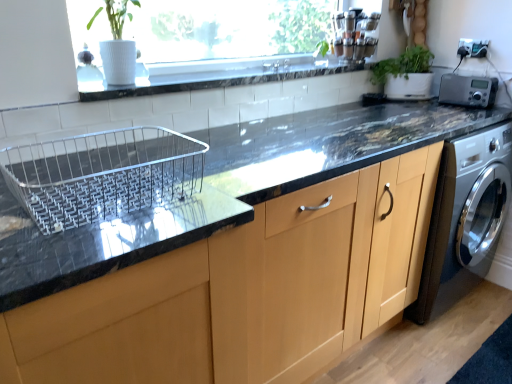
Where is `white tile at upper center`? The image size is (512, 384). white tile at upper center is located at coordinates (217, 80).

What is the approximate width of matte wood cabinet at center?

matte wood cabinet at center is 65.91 centimeters wide.

Where is `silver metallic radio at upper right`? This screenshot has height=384, width=512. silver metallic radio at upper right is located at coordinates (468, 90).

Does silver metallic radio at upper right lie behind green matte plant at upper right?

No, silver metallic radio at upper right is in front of green matte plant at upper right.

Is silver metallic radio at upper right turned away from green matte plant at upper right?

No, silver metallic radio at upper right's orientation is not away from green matte plant at upper right.

Is silver metallic radio at upper right far from green matte plant at upper right?

silver metallic radio at upper right is actually quite close to green matte plant at upper right.

Locate an element on the screen. This screenshot has height=384, width=512. appliance below the green matte plant at upper right (from a real-world perspective) is located at coordinates (468, 90).

Can you tell me how much white tile at upper center and matte wood cabinet at center differ in facing direction?

The angular difference between white tile at upper center and matte wood cabinet at center is 0.000114 degrees.

Considering the sizes of white tile at upper center and matte wood cabinet at center in the image, is white tile at upper center taller or shorter than matte wood cabinet at center?

Considering their sizes, white tile at upper center has less height than matte wood cabinet at center.

Looking at their sizes, would you say white tile at upper center is wider or thinner than matte wood cabinet at center?

In the image, white tile at upper center appears to be more narrow than matte wood cabinet at center.

Does green matte plant at upper right touch white tile at upper center?

green matte plant at upper right is not next to white tile at upper center, and they're not touching.

Locate an element on the screen. window sill in front of the green matte plant at upper right is located at coordinates (217, 80).

What's the angular difference between green matte plant at upper right and white tile at upper center's facing directions?

The angular difference between green matte plant at upper right and white tile at upper center is 40.6 degrees.

Considering the sizes of green matte plant at upper right and white tile at upper center in the image, is green matte plant at upper right bigger or smaller than white tile at upper center?

Considering their sizes, green matte plant at upper right takes up more space than white tile at upper center.

Is matte wood cabinet at center inside the boundaries of silver metallic radio at upper right, or outside?

matte wood cabinet at center is not enclosed by silver metallic radio at upper right.

Consider the image. How many degrees apart are the facing directions of matte wood cabinet at center and silver metallic radio at upper right?

90 degrees.

In terms of width, does matte wood cabinet at center look wider or thinner when compared to silver metallic radio at upper right?

In the image, matte wood cabinet at center appears to be wider than silver metallic radio at upper right.

Is matte wood cabinet at center oriented away from silver metallic radio at upper right?

No, matte wood cabinet at center is not facing the opposite direction of silver metallic radio at upper right.

From a real-world perspective, which object rests below the other?

silver metallic radio at upper right is physically lower.

Do you think white tile at upper center is within silver metallic radio at upper right, or outside of it?

white tile at upper center exists outside the volume of silver metallic radio at upper right.

Is silver metallic radio at upper right at the back of white tile at upper center?

No, white tile at upper center is not facing away from silver metallic radio at upper right.

Which is in front, white tile at upper center or silver metallic radio at upper right?

white tile at upper center.

This screenshot has height=384, width=512. Identify the location of appliance that is under the white tile at upper center (from a real-world perspective). (468, 90).

Which object is wider, silver metallic radio at upper right or white tile at upper center?

Wider between the two is white tile at upper center.

From a real-world perspective, which is physically below, silver metallic radio at upper right or white tile at upper center?

From a 3D spatial view, silver metallic radio at upper right is below.

From a real-world perspective, which is physically below, green matte plant at upper right or silver metallic radio at upper right?

silver metallic radio at upper right.

Visually, is green matte plant at upper right positioned to the left or to the right of silver metallic radio at upper right?

Clearly, green matte plant at upper right is on the left of silver metallic radio at upper right in the image.

Measure the distance from green matte plant at upper right to silver metallic radio at upper right.

A distance of 8.88 inches exists between green matte plant at upper right and silver metallic radio at upper right.

What's the angular difference between green matte plant at upper right and silver metallic radio at upper right's facing directions?

The facing directions of green matte plant at upper right and silver metallic radio at upper right are 49.4 degrees apart.

Where is `appliance in front of the green matte plant at upper right`? This screenshot has height=384, width=512. appliance in front of the green matte plant at upper right is located at coordinates (468, 90).

This screenshot has width=512, height=384. Identify the location of cabinetry that is below the white tile at upper center (from the image's perspective). (319, 270).

Looking at the image, which one is located closer to matte wood cabinet at center, green matte plant at upper right or white tile at upper center?

white tile at upper center is positioned closer to the anchor matte wood cabinet at center.

Considering their positions, is matte wood cabinet at center positioned further to silver metallic radio at upper right than green matte plant at upper right?

Among the two, matte wood cabinet at center is located further to silver metallic radio at upper right.

From the image, which object appears to be farther from silver metallic radio at upper right, matte wood cabinet at center or white tile at upper center?

matte wood cabinet at center is further to silver metallic radio at upper right.

When comparing their distances from green matte plant at upper right, does white tile at upper center or silver metallic radio at upper right seem closer?

The object closer to green matte plant at upper right is silver metallic radio at upper right.

Estimate the real-world distances between objects in this image. Which object is closer to matte wood cabinet at center, white tile at upper center or green matte plant at upper right?

Among the two, white tile at upper center is located nearer to matte wood cabinet at center.

Based on their spatial positions, is silver metallic radio at upper right or green matte plant at upper right further from matte wood cabinet at center?

The object further to matte wood cabinet at center is green matte plant at upper right.

Consider the image. Looking at the image, which one is located further to silver metallic radio at upper right, green matte plant at upper right or matte wood cabinet at center?

matte wood cabinet at center is positioned further to the anchor silver metallic radio at upper right.

Which object lies further to the anchor point green matte plant at upper right, silver metallic radio at upper right or matte wood cabinet at center?

matte wood cabinet at center lies further to green matte plant at upper right than the other object.

The width and height of the screenshot is (512, 384). In order to click on appliance between matte wood cabinet at center and green matte plant at upper right in the front-back direction in this screenshot , I will do `click(468, 90)`.

You are a GUI agent. You are given a task and a screenshot of the screen. Output one action in this format:
    pyautogui.click(x=<x>, y=<y>)
    Task: Click on the plant located between white tile at upper center and silver metallic radio at upper right in the left-right direction
    The height and width of the screenshot is (384, 512).
    Given the screenshot: What is the action you would take?
    pyautogui.click(x=402, y=65)

Where is `cabinetry between white tile at upper center and silver metallic radio at upper right in the horizontal direction`? This screenshot has height=384, width=512. cabinetry between white tile at upper center and silver metallic radio at upper right in the horizontal direction is located at coordinates (319, 270).

Where is `window sill positioned between matte wood cabinet at center and green matte plant at upper right from near to far`? window sill positioned between matte wood cabinet at center and green matte plant at upper right from near to far is located at coordinates (217, 80).